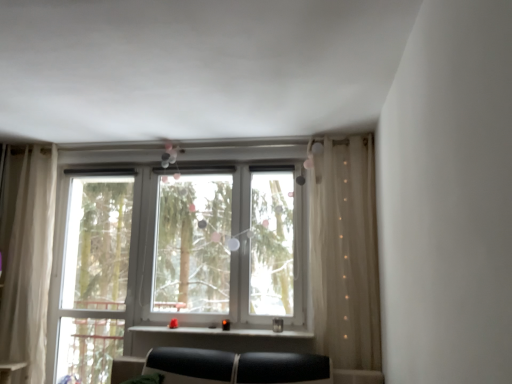
Question: From a real-world perspective, is matte black window sill at center physically below white plastic bay window at center?

Choices:
 (A) no
 (B) yes

Answer: (B)

Question: From the image's perspective, would you say matte black window sill at center is shown under white plastic bay window at center?

Choices:
 (A) yes
 (B) no

Answer: (A)

Question: Would you say white plastic bay window at center is part of matte black window sill at center's contents?

Choices:
 (A) yes
 (B) no

Answer: (B)

Question: Is matte black window sill at center smaller than white plastic bay window at center?

Choices:
 (A) yes
 (B) no

Answer: (A)

Question: Is matte black window sill at center not near white plastic bay window at center?

Choices:
 (A) yes
 (B) no

Answer: (B)

Question: Looking at the image, does clear glass window at left seem bigger or smaller compared to sheer beige curtain at right, which is the 1th curtain from right to left?

Choices:
 (A) small
 (B) big

Answer: (A)

Question: From the image's perspective, is clear glass window at left located above or below sheer beige curtain at right, the 2th curtain in the left-to-right sequence?

Choices:
 (A) below
 (B) above

Answer: (A)

Question: In the image, is clear glass window at left positioned in front of or behind sheer beige curtain at right, the 2th curtain in the left-to-right sequence?

Choices:
 (A) front
 (B) behind

Answer: (B)

Question: From a real-world perspective, relative to sheer beige curtain at right, which is the 1th curtain from right to left, is clear glass window at left vertically above or below?

Choices:
 (A) above
 (B) below

Answer: (B)

Question: In the image, is sheer white curtain at left, positioned as the 2th curtain in right-to-left order, on the left side or the right side of clear glass window at left?

Choices:
 (A) left
 (B) right

Answer: (A)

Question: From the image's perspective, is sheer white curtain at left, the 1th curtain positioned from the left, located above or below clear glass window at left?

Choices:
 (A) below
 (B) above

Answer: (B)

Question: Is sheer white curtain at left, positioned as the 2th curtain in right-to-left order, wider or thinner than clear glass window at left?

Choices:
 (A) wide
 (B) thin

Answer: (A)

Question: In terms of size, does sheer white curtain at left, positioned as the 2th curtain in right-to-left order, appear bigger or smaller than clear glass window at left?

Choices:
 (A) big
 (B) small

Answer: (A)

Question: Based on their sizes in the image, would you say matte black window sill at center is bigger or smaller than white plastic bay window at center?

Choices:
 (A) small
 (B) big

Answer: (A)

Question: Is matte black window sill at center taller or shorter than white plastic bay window at center?

Choices:
 (A) short
 (B) tall

Answer: (A)